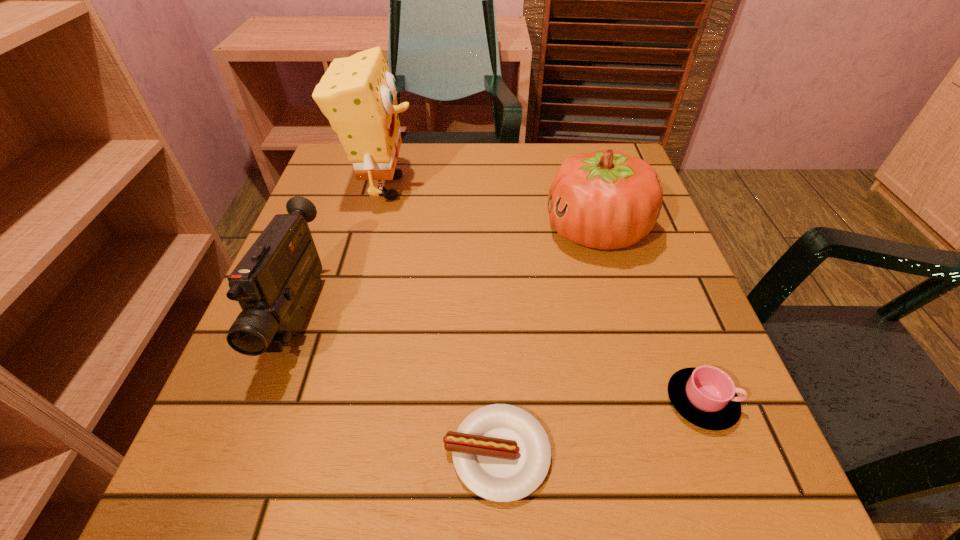
At what (x,y) coordinates should I click in order to perform the action: click on vacant space that is in between the pumpkin and the sausage. Please return your answer as a coordinate pair (x, y). Looking at the image, I should click on (546, 342).

I want to click on vacant area that lies between the camcorder and the cup, so click(x=500, y=359).

Where is `free space between the sponge and the third object from right to left`? free space between the sponge and the third object from right to left is located at coordinates (441, 320).

You are a GUI agent. You are given a task and a screenshot of the screen. Output one action in this format:
    pyautogui.click(x=<x>, y=<y>)
    Task: Click on the blank region between the pumpkin and the cup
    
    Given the screenshot: What is the action you would take?
    pyautogui.click(x=649, y=316)

Choose which object is the third nearest neighbor to the cup. Please provide its 2D coordinates. Your answer should be formatted as a tuple, i.e. [(x, y)], where the tuple contains the x and y coordinates of a point satisfying the conditions above.

[(275, 283)]

Identify which object is located as the third nearest to the pumpkin. Please provide its 2D coordinates. Your answer should be formatted as a tuple, i.e. [(x, y)], where the tuple contains the x and y coordinates of a point satisfying the conditions above.

[(501, 453)]

Where is `vacant space that satisfies the following two spatial constraints: 1. on the front-facing side of the camcorder; 2. on the left side of the sausage`? vacant space that satisfies the following two spatial constraints: 1. on the front-facing side of the camcorder; 2. on the left side of the sausage is located at coordinates (249, 453).

Image resolution: width=960 pixels, height=540 pixels. Find the location of `blank area in the image that satisfies the following two spatial constraints: 1. on the side with the handle of the cup; 2. on the front side of the third object from right to left`. blank area in the image that satisfies the following two spatial constraints: 1. on the side with the handle of the cup; 2. on the front side of the third object from right to left is located at coordinates (721, 453).

This screenshot has height=540, width=960. In order to click on free point that satisfies the following two spatial constraints: 1. on the side of the pumpkin with the cute face; 2. on the front side of the sausage in this screenshot , I will do `click(660, 453)`.

I want to click on free space that satisfies the following two spatial constraints: 1. on the side of the pumpkin with the cute face; 2. on the front-facing side of the camcorder, so click(x=621, y=317).